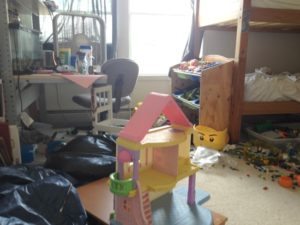
At what (x,y) coordinates should I click in order to perform the action: click on windows. Please return your answer as a coordinate pair (x, y). The image size is (300, 225). Looking at the image, I should click on (159, 29), (82, 2), (47, 24).